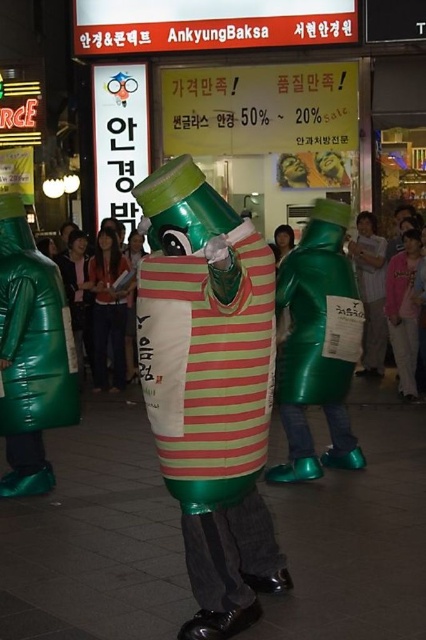
You are a photographer trying to capture the central figure in the scene. You notice the striped fabric can at center and the pink fabric shirt at center. Which object should you focus on to ensure the other is partially hidden in the photo?

To ensure the pink fabric shirt at center is partially hidden, focus on the striped fabric can at center since it is in front of the pink fabric shirt at center.

You are a photographer standing 3 meters away from the green matte bottle at center and the pink fabric shirt at center. Can you capture both objects in a single frame without moving your camera? Explain your reasoning.

The distance between the green matte bottle at center and the pink fabric shirt at center is 2.96 meters. Since you are 3 meters away from both objects, they are within a reasonable framing range for most camera lenses. Therefore, you can likely capture both in a single frame without moving the camera.